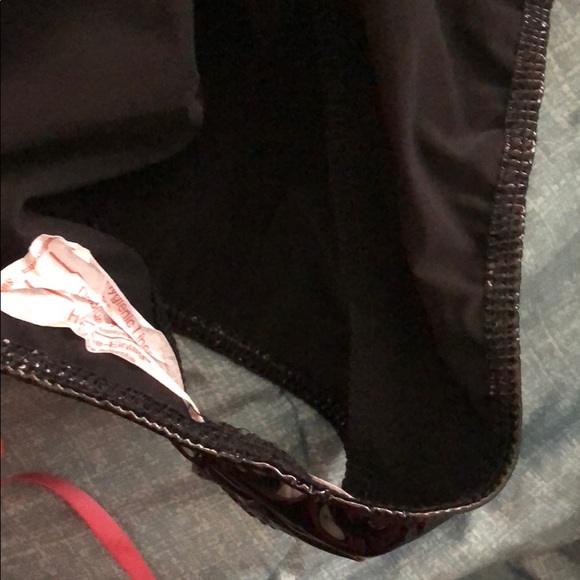
Where is `grey blanket`? This screenshot has width=580, height=580. grey blanket is located at coordinates (553, 319).